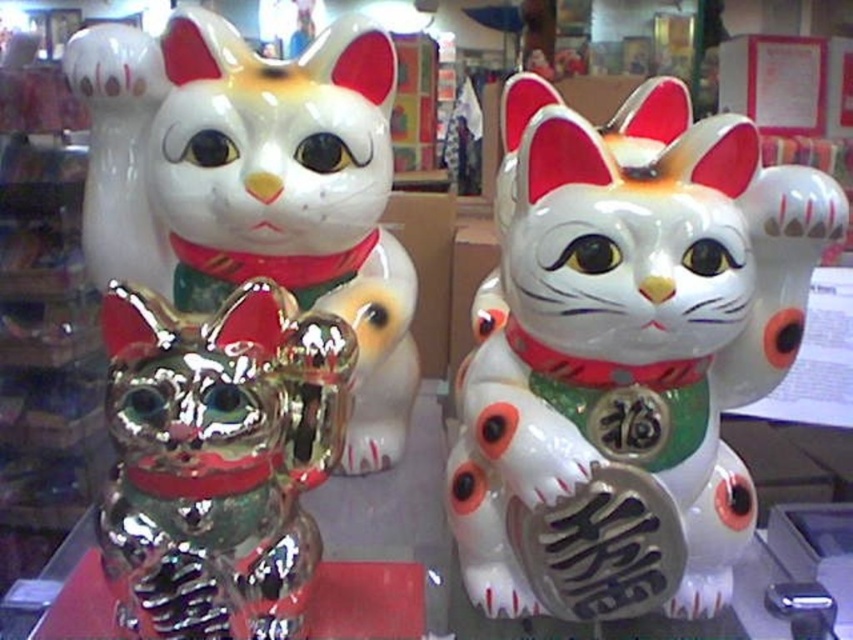
You are a delivery person trying to place a small package between the white glossy ceramic cat at center and the shiny metallic cat at left. Can the package, which is 10 inches long, fit in the space between them?

The distance between the white glossy ceramic cat at center and the shiny metallic cat at left is 9.92 inches. Since the package is 10 inches long, it cannot fit in the space between them.

You are an interior designer arranging a display shelf. You have two cats to place on the shelf. The white glossy ceramic cat at center and the shiny metallic cat at center. Given that the shelf has limited space, which cat should you choose to fit better if you need a smaller footprint?

The shiny metallic cat at center has a smaller width compared to the white glossy ceramic cat at center, so it would fit better on the shelf with limited space.

You are organizing a display of Maneki Neko figurines. You have a shiny metallic cat at center and a shiny metallic cat at left. Which one should you place on a smaller shelf to ensure it fits properly?

The shiny metallic cat at center is smaller than the shiny metallic cat at left, so it should be placed on the smaller shelf to ensure it fits properly.